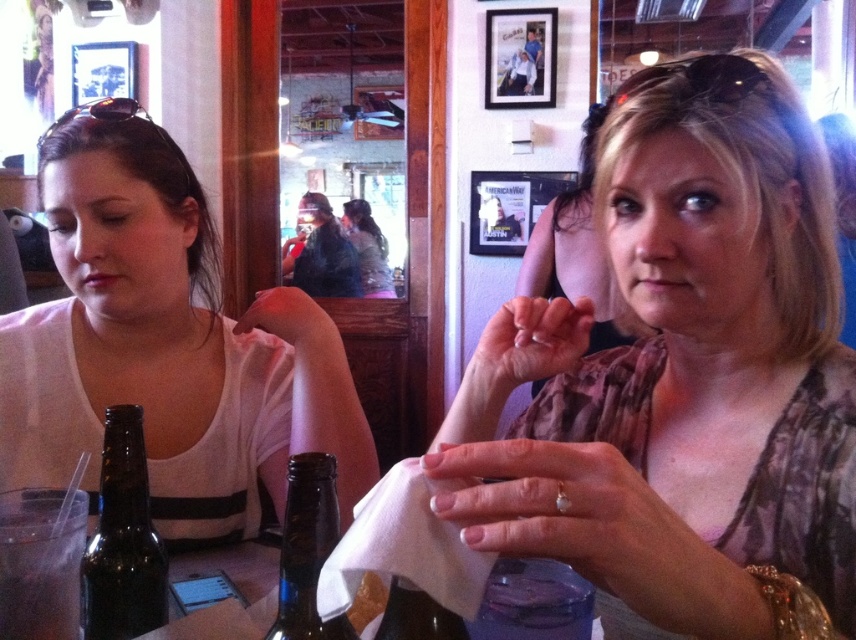
Question: Is brown glass bottle at lower center smaller than dark brown leather jacket at center?

Choices:
 (A) yes
 (B) no

Answer: (A)

Question: Which point is closer to the camera?

Choices:
 (A) (25, 611)
 (B) (342, 516)

Answer: (A)

Question: Which of these objects is positioned closest to the white matte shirt at left?

Choices:
 (A) brown glass bottle at lower left
 (B) matte floral blouse at center
 (C) matte black jacket at center

Answer: (A)

Question: Can you confirm if brown glass bottle at lower center is positioned below translucent plastic cup at lower center?

Choices:
 (A) yes
 (B) no

Answer: (B)

Question: Considering the relative positions of white matte shirt at left and matte black jacket at center in the image provided, where is white matte shirt at left located with respect to matte black jacket at center?

Choices:
 (A) above
 (B) below

Answer: (B)

Question: Which is farther from the white matte shirt at left?

Choices:
 (A) matte floral blouse at center
 (B) clear plastic cup at lower left
 (C) translucent plastic cup at lower center

Answer: (C)